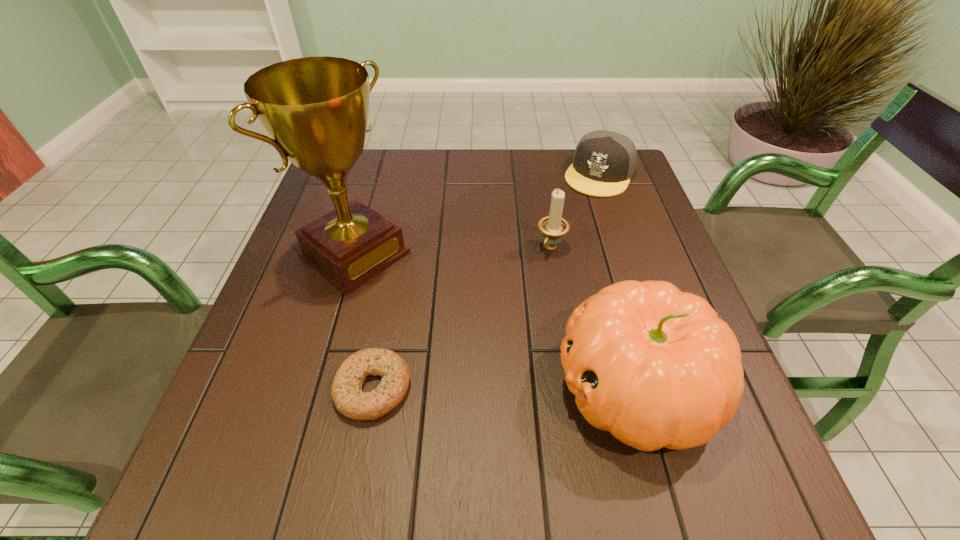
This screenshot has width=960, height=540. In order to click on blank region between the shortest object and the fourth shortest object in this screenshot , I will do `click(504, 387)`.

This screenshot has width=960, height=540. Identify the location of free space between the tallest object and the candle_holder. (453, 251).

Where is `vacant point located between the second tallest object and the tallest object`? vacant point located between the second tallest object and the tallest object is located at coordinates (495, 320).

Choose which object is the fourth nearest neighbor to the fourth tallest object. Please provide its 2D coordinates. Your answer should be formatted as a tuple, i.e. [(x, y)], where the tuple contains the x and y coordinates of a point satisfying the conditions above.

[(349, 400)]

The image size is (960, 540). Find the location of `object identified as the fourth closest to the candle_holder`. object identified as the fourth closest to the candle_holder is located at coordinates (349, 400).

Identify the location of vacant space that satisfies the following two spatial constraints: 1. on the back side of the fourth shortest object; 2. on the carved face of the bagel. The width and height of the screenshot is (960, 540). (373, 386).

Find the location of a particular element. This screenshot has width=960, height=540. vacant area that satisfies the following two spatial constraints: 1. on the front side of the tallest object; 2. on the right side of the bagel is located at coordinates (316, 388).

Find the location of a particular element. This screenshot has height=540, width=960. free point that satisfies the following two spatial constraints: 1. on the front side of the tallest object; 2. on the carved face of the pumpkin is located at coordinates (317, 386).

Locate an element on the screen. This screenshot has height=540, width=960. free region that satisfies the following two spatial constraints: 1. on the back side of the bagel; 2. on the carved face of the pumpkin is located at coordinates (373, 386).

Identify the location of vacant area in the image that satisfies the following two spatial constraints: 1. on the front side of the third tallest object; 2. on the carved face of the second tallest object. (573, 386).